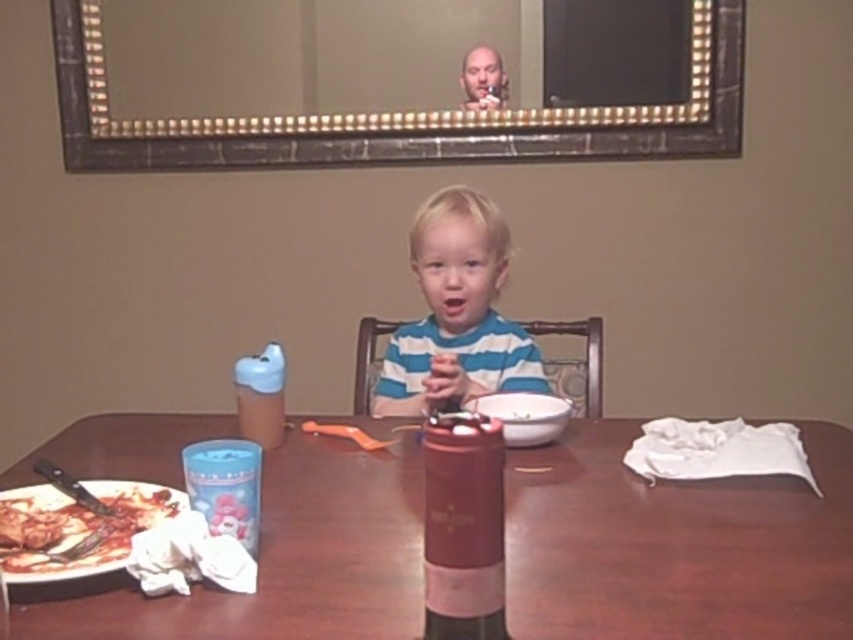
Question: Which of the following is the farthest from the observer?

Choices:
 (A) coord(154,467)
 (B) coord(450,540)

Answer: (A)

Question: Which object appears farthest from the camera in this image?

Choices:
 (A) blue striped shirt at center
 (B) shiny metallic pizza at lower left

Answer: (A)

Question: Which of the following is the closest to the observer?

Choices:
 (A) (722, 627)
 (B) (508, 381)
 (C) (457, 410)

Answer: (A)

Question: Is wooden table at center further to the viewer compared to blue striped shirt at center?

Choices:
 (A) yes
 (B) no

Answer: (B)

Question: Is wooden table at center below shiny metallic pizza at lower left?

Choices:
 (A) yes
 (B) no

Answer: (B)

Question: Does blue striped shirt at center appear over shiny metallic pizza at lower left?

Choices:
 (A) yes
 (B) no

Answer: (A)